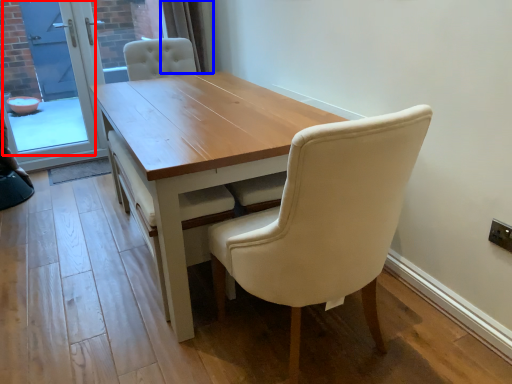
Question: Which object appears closest to the camera in this image, screen door (highlighted by a red box) or curtain (highlighted by a blue box)?

Choices:
 (A) screen door
 (B) curtain

Answer: (A)